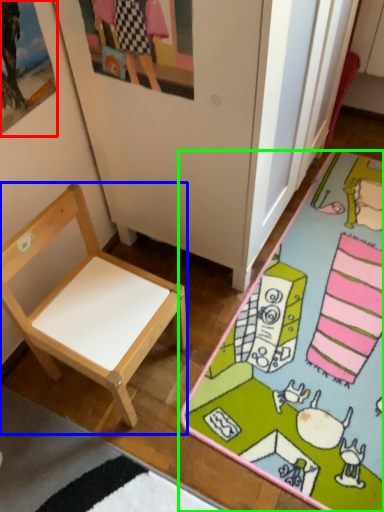
Question: Which object is positioned closest to picture frame (highlighted by a red box)? Select from chair (highlighted by a blue box) and desk (highlighted by a green box).

Choices:
 (A) chair
 (B) desk

Answer: (A)